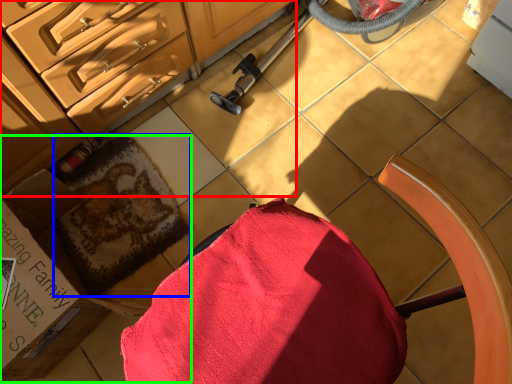
Question: Considering the real-world distances, which object is closest to cabinetry (highlighted by a red box)? bath towel (highlighted by a blue box) or box (highlighted by a green box).

Choices:
 (A) bath towel
 (B) box

Answer: (B)